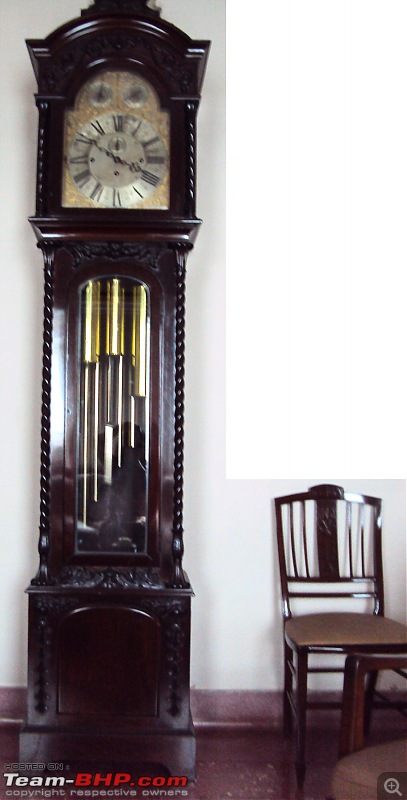
Where is `wooden chair`? This screenshot has width=407, height=800. wooden chair is located at coordinates (350, 626).